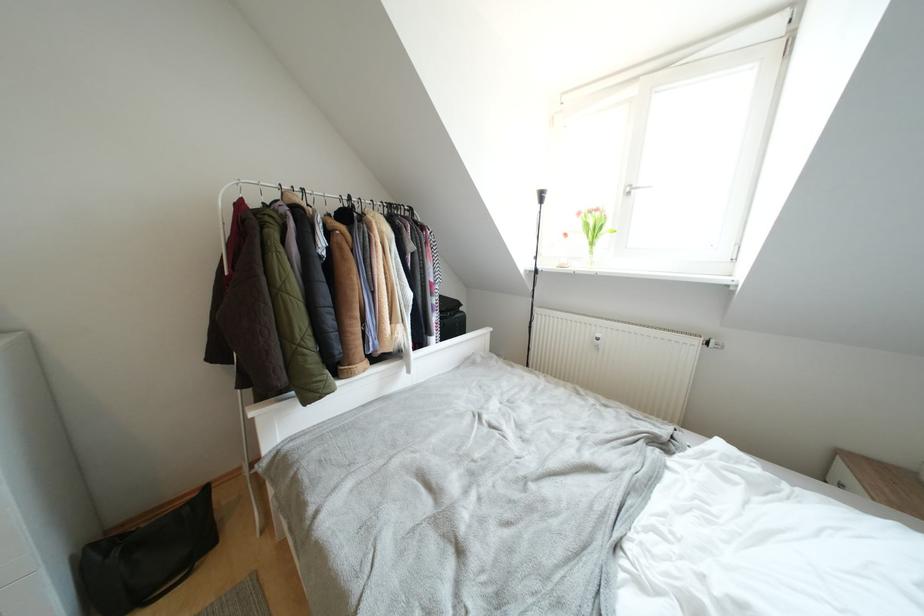
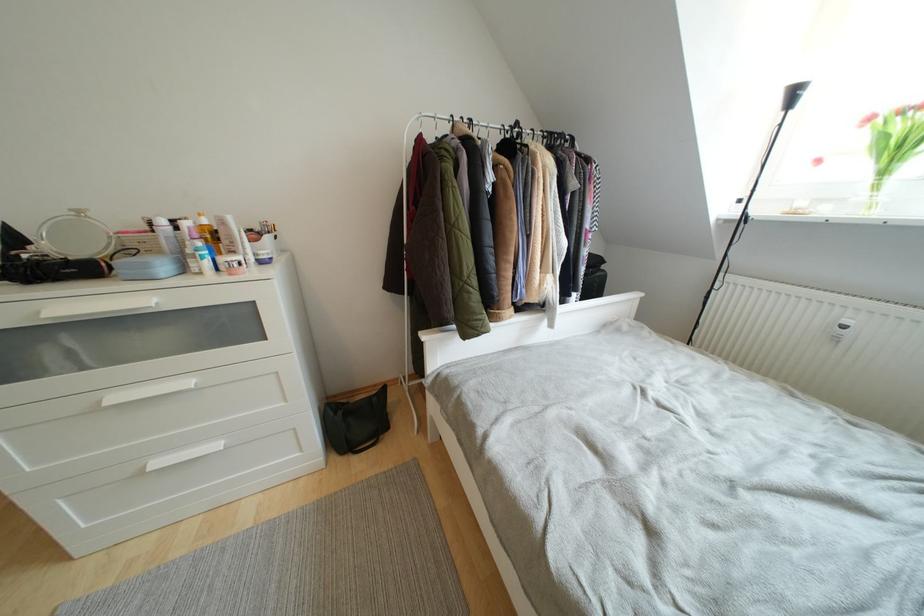
Find the pixel in the second image that matches (603,339) in the first image.

(853, 326)